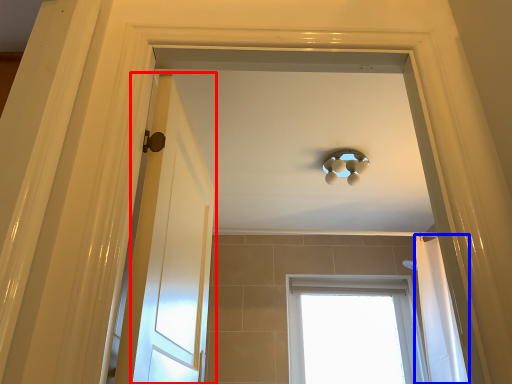
Question: Which point is further to the camera, door (highlighted by a red box) or shower curtain (highlighted by a blue box)?

Choices:
 (A) door
 (B) shower curtain

Answer: (B)